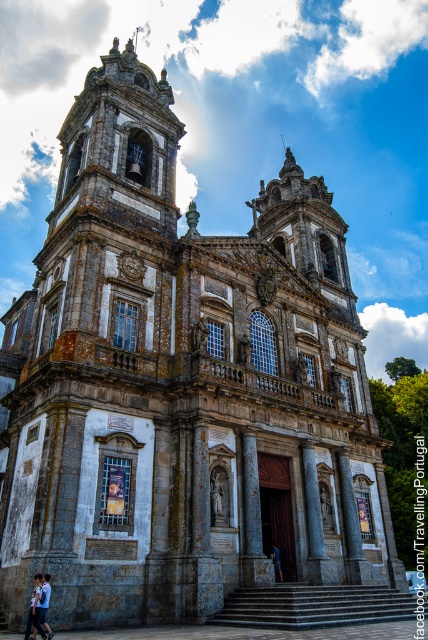
You are standing in front of the historic church and notice two items at the bottom of the image. Which one is taller between the light blue shirt at lower left and the dark blue fabric at lower center?

The light blue shirt at lower left is taller than the dark blue fabric at lower center according to the description.

You are standing in front of the historic church and see a light blue shirt at lower left and a dark blue fabric at lower center. Which object is nearer to you?

The light blue shirt at lower left is closer to the viewer than the dark blue fabric at lower center.